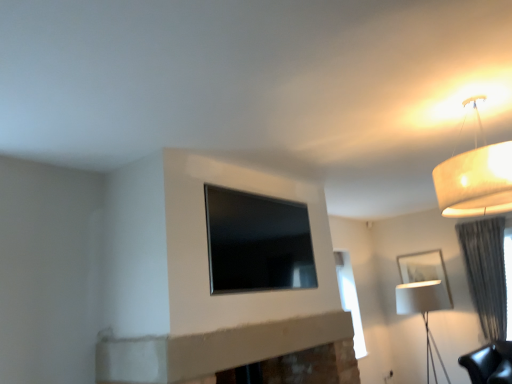
Question: Looking at the image, does matte white lampshade at upper right, the second lamp in the right-to-left sequence, seem bigger or smaller compared to white matte picture frame at right?

Choices:
 (A) small
 (B) big

Answer: (B)

Question: In terms of width, does matte white lampshade at upper right, the first lamp from the front, look wider or thinner when compared to white matte picture frame at right?

Choices:
 (A) wide
 (B) thin

Answer: (A)

Question: Which is farther from the white fabric lampshade at right, placed as the second lamp when sorted from top to bottom?

Choices:
 (A) matte white lampshade at upper right, which appears as the first lamp when viewed from the top
 (B) black glass window at center
 (C) white matte picture frame at right
 (D) gray textured curtain at right

Answer: (A)

Question: Estimate the real-world distances between objects in this image. Which object is closer to the gray textured curtain at right?

Choices:
 (A) matte white lampshade at upper right, which appears as the first lamp when viewed from the top
 (B) white fabric lampshade at right, which is the 2th lamp in left-to-right order
 (C) white matte picture frame at right
 (D) black glass window at center

Answer: (C)